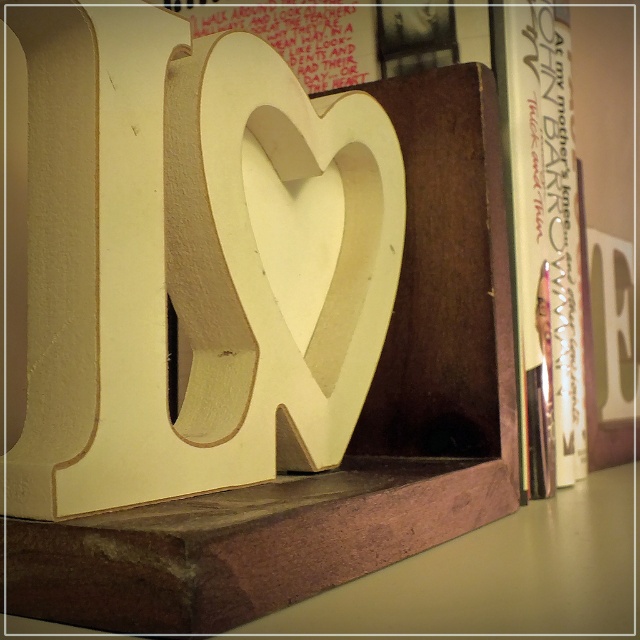
Question: Among these objects, which one is nearest to the camera?

Choices:
 (A) white paper book at right
 (B) white matte wood heart at center

Answer: (B)

Question: Is white matte wood heart at center below white paper book at right?

Choices:
 (A) yes
 (B) no

Answer: (A)

Question: Which point is closer to the camera?

Choices:
 (A) white matte wood heart at center
 (B) white paper book at right

Answer: (A)

Question: Does white matte wood heart at center appear under white paper book at right?

Choices:
 (A) no
 (B) yes

Answer: (B)

Question: Is white matte wood heart at center smaller than white paper book at right?

Choices:
 (A) no
 (B) yes

Answer: (A)

Question: Which point is closer to the camera taking this photo?

Choices:
 (A) 339,300
 (B) 570,378

Answer: (A)